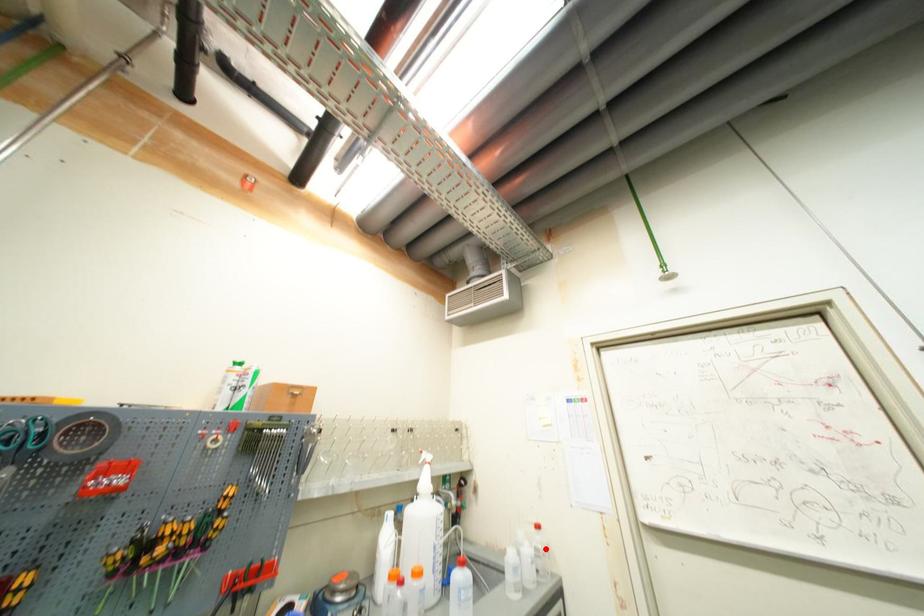
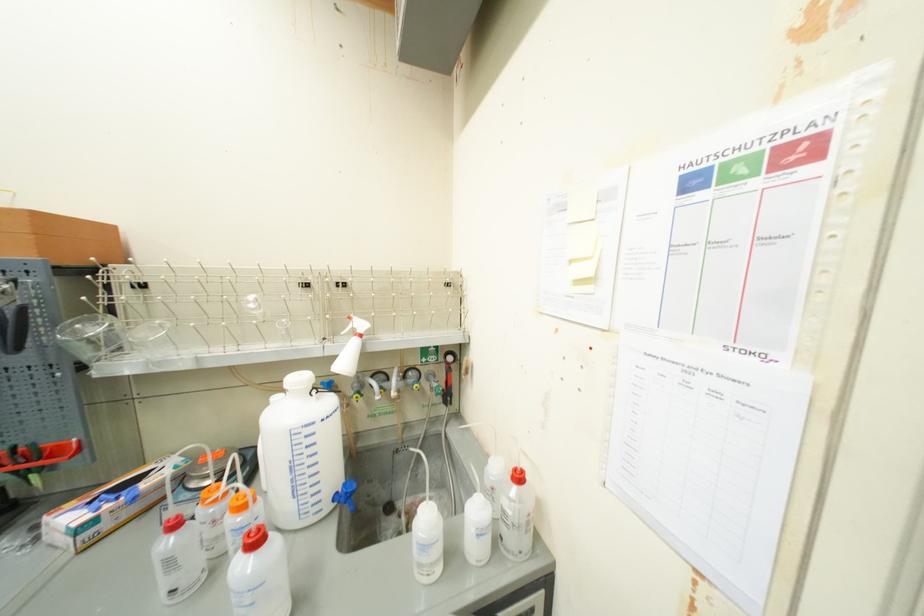
In the second image, find the point that corresponds to the highlighted location in the first image.

(515, 514)